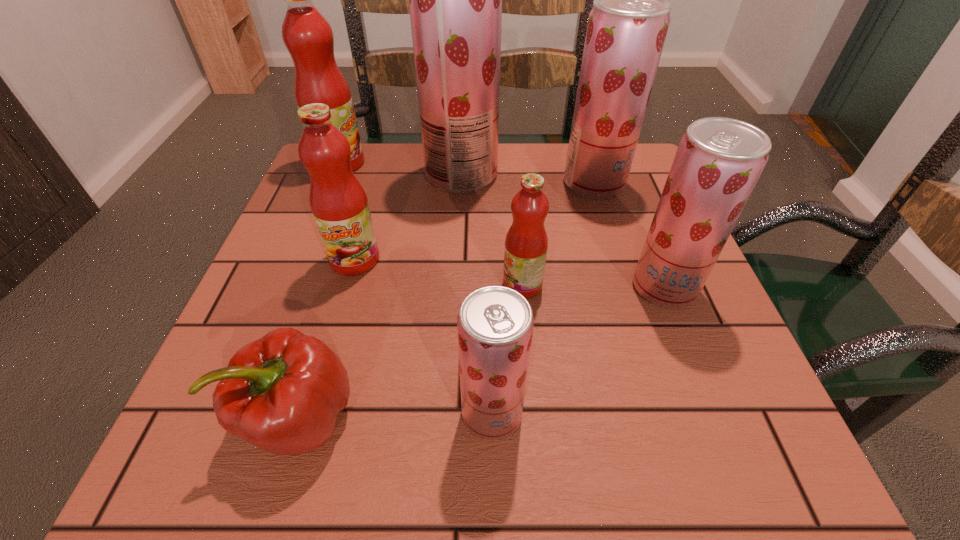
Locate which object ranks third in proximity to the farthest pink fruit juice. Please provide its 2D coordinates. Your answer should be formatted as a tuple, i.e. [(x, y)], where the tuple contains the x and y coordinates of a point satisfying the conditions above.

[(526, 243)]

Locate which fruit juice is the third closest to the second biggest pink fruit juice. Please provide its 2D coordinates. Your answer should be formatted as a tuple, i.e. [(x, y)], where the tuple contains the x and y coordinates of a point satisfying the conditions above.

[(307, 35)]

What are the coordinates of `fruit juice that stands as the sixth closest to the biggest strawberry fruit juice` in the screenshot? It's located at (495, 324).

You are a GUI agent. You are given a task and a screenshot of the screen. Output one action in this format:
    pyautogui.click(x=<x>, y=<y>)
    Task: Click on the closest strawberry fruit juice to the farthest pink fruit juice
    
    Given the screenshot: What is the action you would take?
    pos(455,0)

Identify which strawberry fruit juice is the third closest to the second biggest pink fruit juice. Please provide its 2D coordinates. Your answer should be formatted as a tuple, i.e. [(x, y)], where the tuple contains the x and y coordinates of a point satisfying the conditions above.

[(627, 26)]

This screenshot has height=540, width=960. What are the coordinates of `pink fruit juice identified as the closest to the second biggest pink fruit juice` in the screenshot? It's located at (526, 243).

You are a GUI agent. You are given a task and a screenshot of the screen. Output one action in this format:
    pyautogui.click(x=<x>, y=<y>)
    Task: Click on the pink fruit juice that stands as the third closest to the nearest fruit juice
    
    Given the screenshot: What is the action you would take?
    pyautogui.click(x=307, y=35)

Identify the location of vacant area in the image that satisfies the following two spatial constraints: 1. on the front label of the pepper; 2. on the left side of the biggest pink fruit juice. (236, 418).

Image resolution: width=960 pixels, height=540 pixels. In order to click on vacant point that satisfies the following two spatial constraints: 1. on the back side of the pink pepper; 2. on the right side of the smallest strawberry fruit juice in this screenshot , I will do `click(301, 413)`.

Locate an element on the screen. This screenshot has width=960, height=540. vacant area in the image that satisfies the following two spatial constraints: 1. on the front side of the second biggest strawberry fruit juice; 2. on the right side of the second nearest strawberry fruit juice is located at coordinates (627, 287).